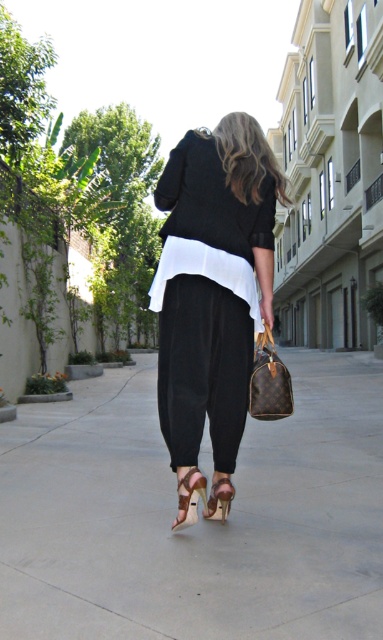
Question: Which point is farther to the camera?

Choices:
 (A) brown leather handbag at lower center
 (B) smooth concrete pavement at center

Answer: (A)

Question: Which object is farther from the camera taking this photo?

Choices:
 (A) suede tan sandal at lower center
 (B) brown leather handbag at lower center

Answer: (A)

Question: Considering the real-world distances, which object is closest to the shiny beige sandal at lower center?

Choices:
 (A) smooth concrete pavement at center
 (B) suede tan sandal at lower center

Answer: (B)

Question: Observing the image, what is the correct spatial positioning of matte black blazer at center in reference to suede tan sandal at lower center?

Choices:
 (A) above
 (B) below

Answer: (A)

Question: Can you confirm if brown leather handbag at lower center is smaller than suede tan sandal at lower center?

Choices:
 (A) yes
 (B) no

Answer: (B)

Question: Observing the image, what is the correct spatial positioning of brown leather handbag at lower center in reference to shiny beige sandal at lower center?

Choices:
 (A) below
 (B) above

Answer: (B)